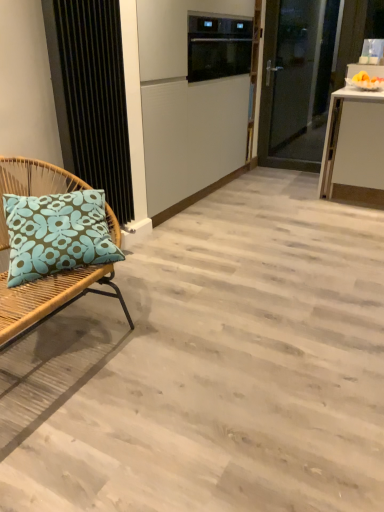
Question: Does rattan cushion at left have a greater width compared to black textured radiator at left?

Choices:
 (A) no
 (B) yes

Answer: (B)

Question: Considering the relative sizes of rattan cushion at left and black textured radiator at left in the image provided, is rattan cushion at left bigger than black textured radiator at left?

Choices:
 (A) no
 (B) yes

Answer: (B)

Question: Could black textured radiator at left be considered to be inside rattan cushion at left?

Choices:
 (A) yes
 (B) no

Answer: (B)

Question: From a real-world perspective, is rattan cushion at left on black textured radiator at left?

Choices:
 (A) no
 (B) yes

Answer: (A)

Question: From the image's perspective, is rattan cushion at left located beneath black textured radiator at left?

Choices:
 (A) yes
 (B) no

Answer: (A)

Question: Based on their sizes in the image, would you say rattan cushion at left is bigger or smaller than transparent glass door at upper right?

Choices:
 (A) big
 (B) small

Answer: (B)

Question: From a real-world perspective, is rattan cushion at left positioned above or below transparent glass door at upper right?

Choices:
 (A) below
 (B) above

Answer: (A)

Question: Considering their positions, is rattan cushion at left located in front of or behind transparent glass door at upper right?

Choices:
 (A) front
 (B) behind

Answer: (A)

Question: Considering the relative positions of rattan cushion at left and transparent glass door at upper right in the image provided, is rattan cushion at left to the left or to the right of transparent glass door at upper right?

Choices:
 (A) right
 (B) left

Answer: (B)

Question: Is black textured radiator at left in front of or behind rattan cushion at left in the image?

Choices:
 (A) behind
 (B) front

Answer: (A)

Question: Do you think black textured radiator at left is within rattan cushion at left, or outside of it?

Choices:
 (A) outside
 (B) inside

Answer: (A)

Question: Does point (52, 61) appear closer or farther from the camera than point (34, 294)?

Choices:
 (A) farther
 (B) closer

Answer: (A)

Question: From a real-world perspective, relative to rattan cushion at left, is black textured radiator at left vertically above or below?

Choices:
 (A) below
 (B) above

Answer: (B)

Question: From the image's perspective, is transparent glass door at upper right positioned above or below rattan cushion at left?

Choices:
 (A) above
 (B) below

Answer: (A)

Question: Would you say transparent glass door at upper right is inside or outside rattan cushion at left?

Choices:
 (A) inside
 (B) outside

Answer: (B)